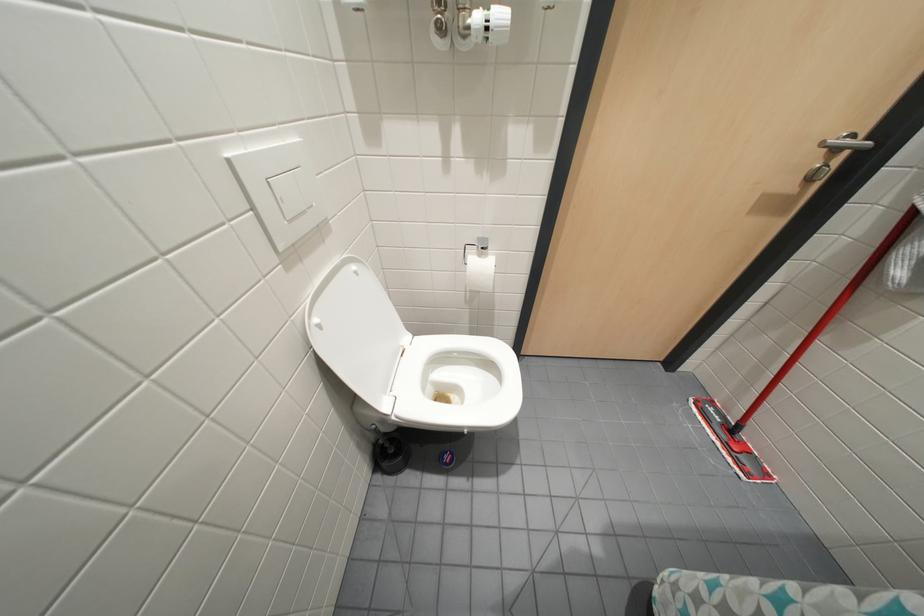
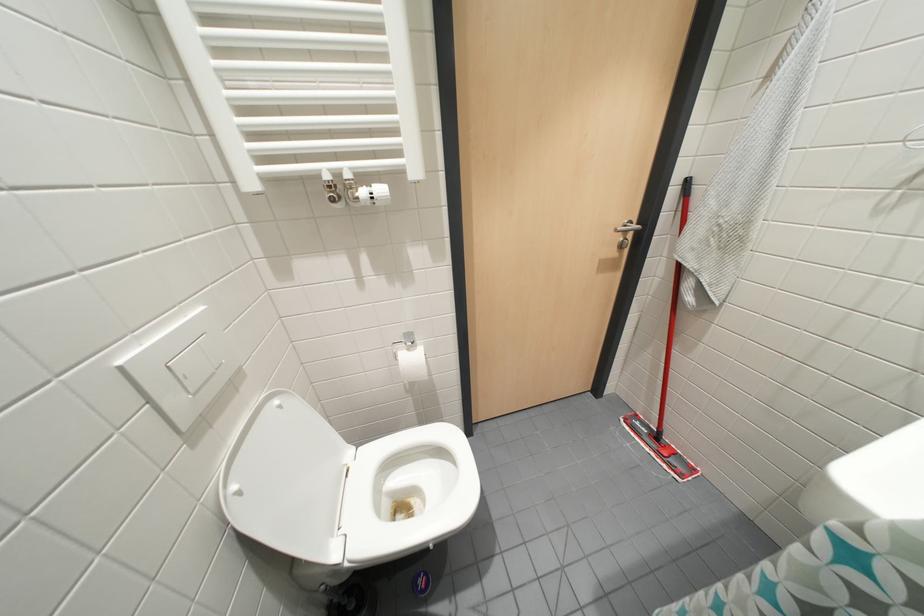
Question: The camera is either moving clockwise (left) or counter-clockwise (right) around the object. The first image is from the beginning of the video and the second image is from the end. Is the camera moving left or right when shooting the video?

Choices:
 (A) Left
 (B) Right

Answer: (A)